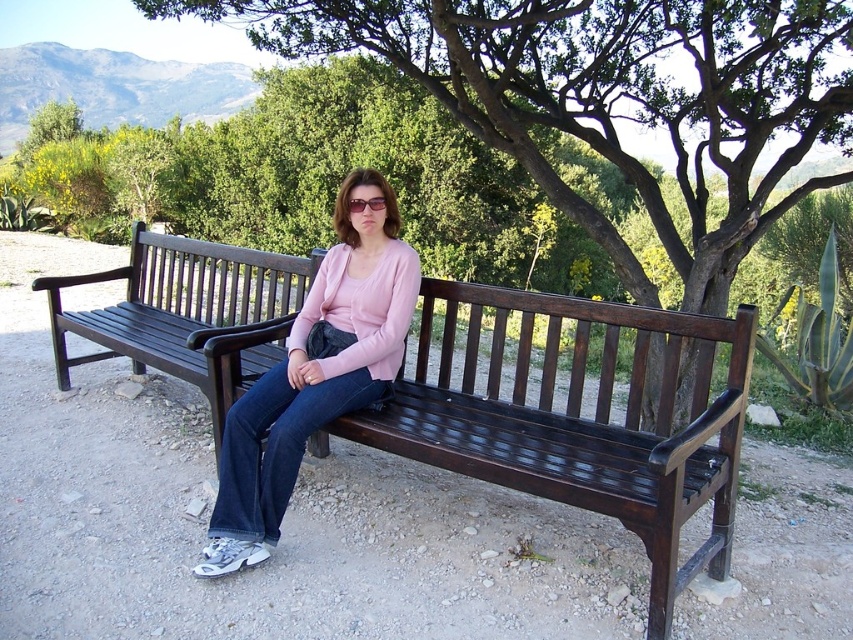
You are standing at the center of the image and want to locate the green leafy tree at center. Which direction should you look to find it?

The green leafy tree at center is located at point coordinates of [608,97], so you should look to the left side of the image to find it.

You are a hiker who wants to place a small picnic basket between the green leafy tree at center and the matte pink sweater at center. How far apart are these two objects?

The green leafy tree at center is 9.08 feet away from the matte pink sweater at center, so the picnic basket can be placed between them at that distance.

You are planning to take a photo of the dark brown wood bench at center and the green leafy tree at center. Which object will appear wider in the photo?

The dark brown wood bench at center will appear wider in the photo since the green leafy tree at center has a smaller width according to the description.